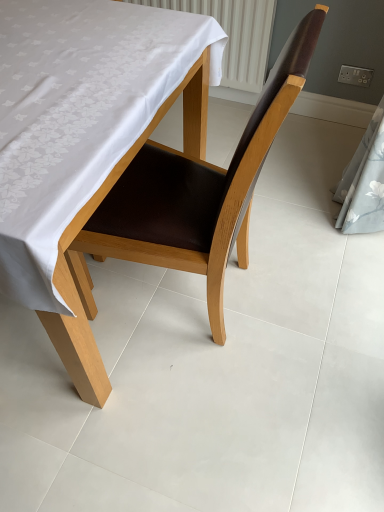
At what (x,y) coordinates should I click in order to perform the action: click on free space in front of brown leather chair at center. Please return your answer as a coordinate pair (x, y). The width and height of the screenshot is (384, 512). Looking at the image, I should click on (204, 411).